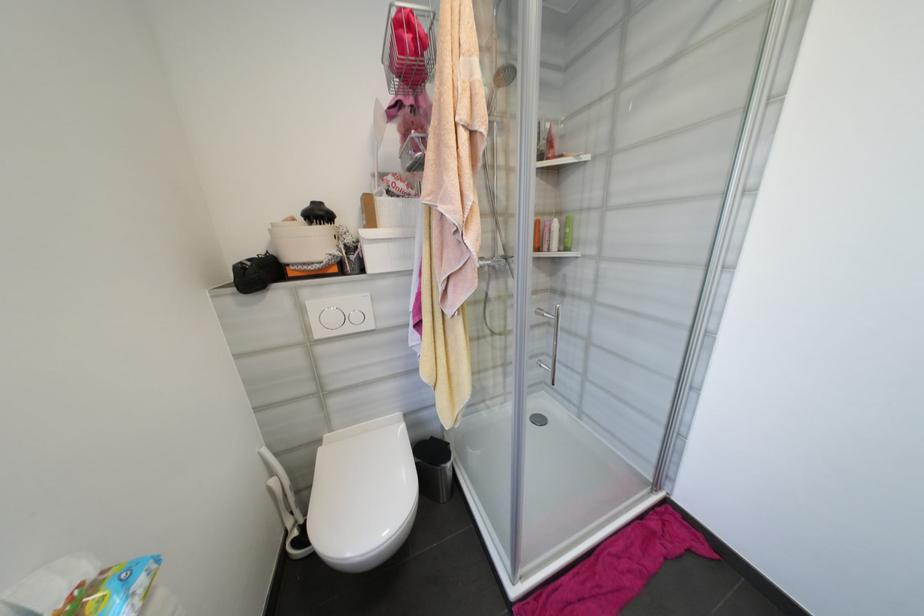
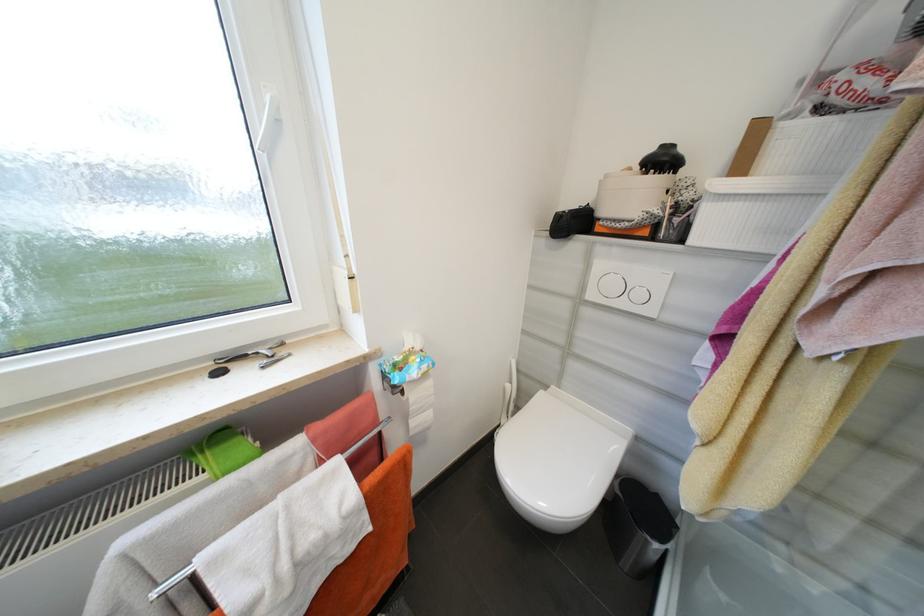
Based on the continuous images, in which direction is the camera rotating?

The rotation direction of the camera is left-down.